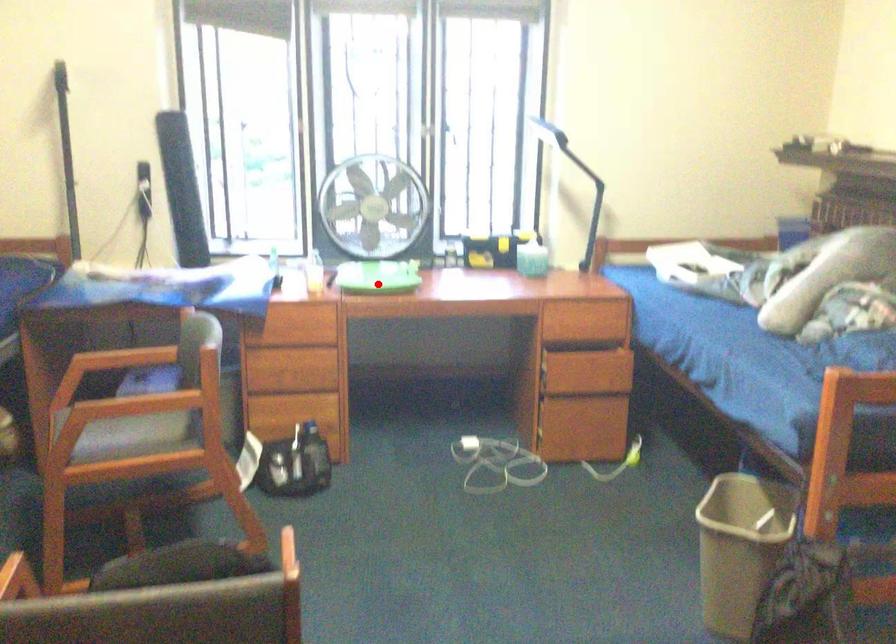
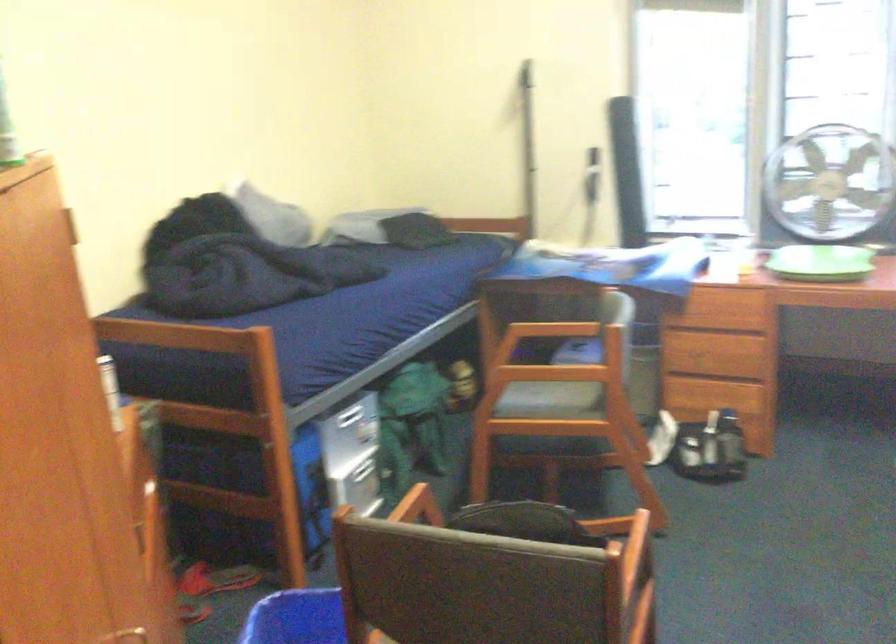
The point at the highlighted location is marked in the first image. Where is the corresponding point in the second image?

(821, 263)